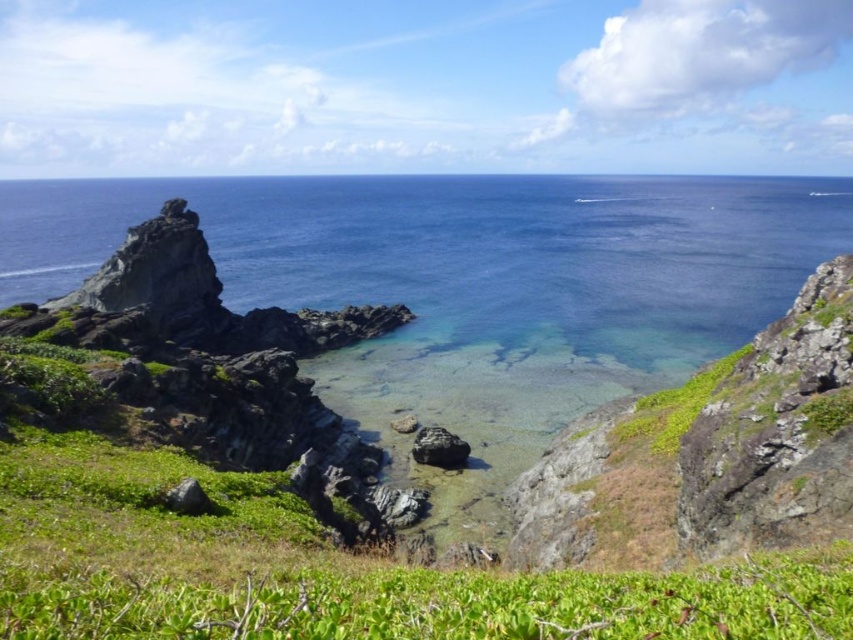
You are a botanist studying the vegetation in this coastal landscape. You notice two patches of green leafy grass at lower center and green leafy grass at lower right. Which of these two patches has a larger width?

The green leafy grass at lower center might be wider than green leafy grass at lower right according to the description.

You are standing at the center of the rocky terrain in the coastal landscape. You notice a point marked at coordinates (672,406). What type of vegetation is located at that point?

The point at (672,406) corresponds to green leafy grass at lower right.

You are standing at the edge of the rocky terrain in the coastal landscape. You see two points marked on the ground. One is at coordinate point (735,353) and the other at point (186,509). Which point is closer to you?

Point (186,509) is closer to you because it is less further to the camera than point (735,353).